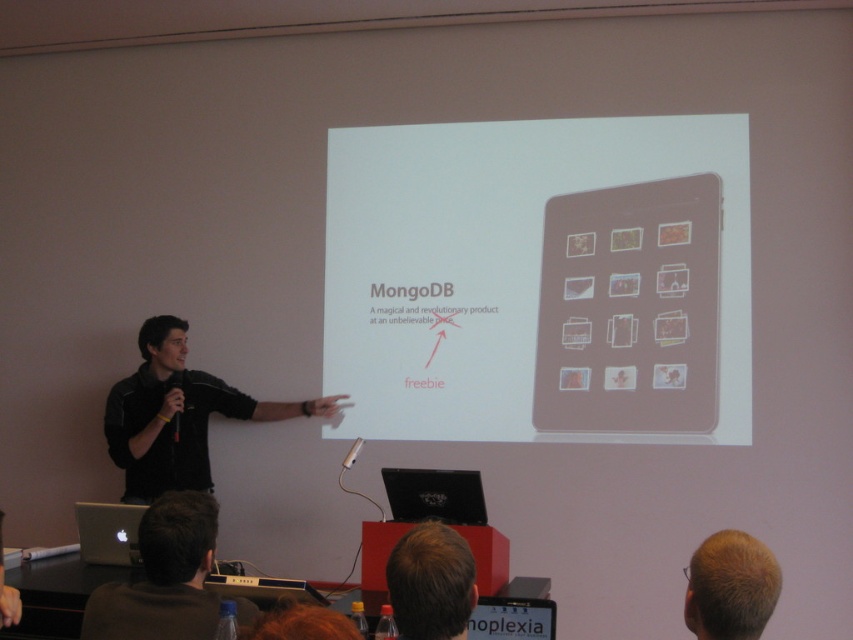
You are an attendee at the presentation. You want to take a photo of the black matte laptop at lower center but need to avoid blocking the view of the person sitting behind you. Since the black shirt at left is in your way, can you move around it to get a clear shot of the laptop?

The black matte laptop at lower center is behind the black shirt at left, so moving around the black shirt at left might not be necessary. You can take the photo from your current position as the laptop is already positioned behind the shirt, which might be out of the attendee behind you view.

You are an attendee at the presentation. You see the point at coordinates (x=630, y=308). Where exactly is this point located on the tablet?

The point at coordinates (x=630, y=308) is located on the matte brown tablet at upper center.